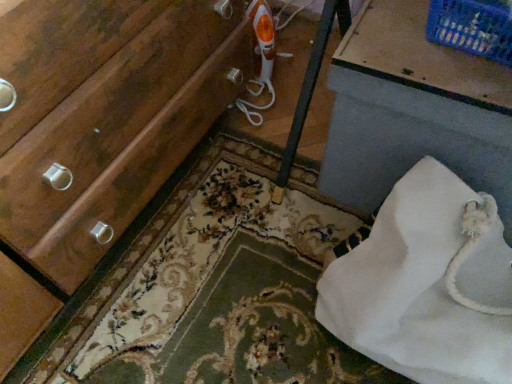
This screenshot has height=384, width=512. I want to click on free space to the left of white fabric bag at lower right, so click(x=280, y=215).